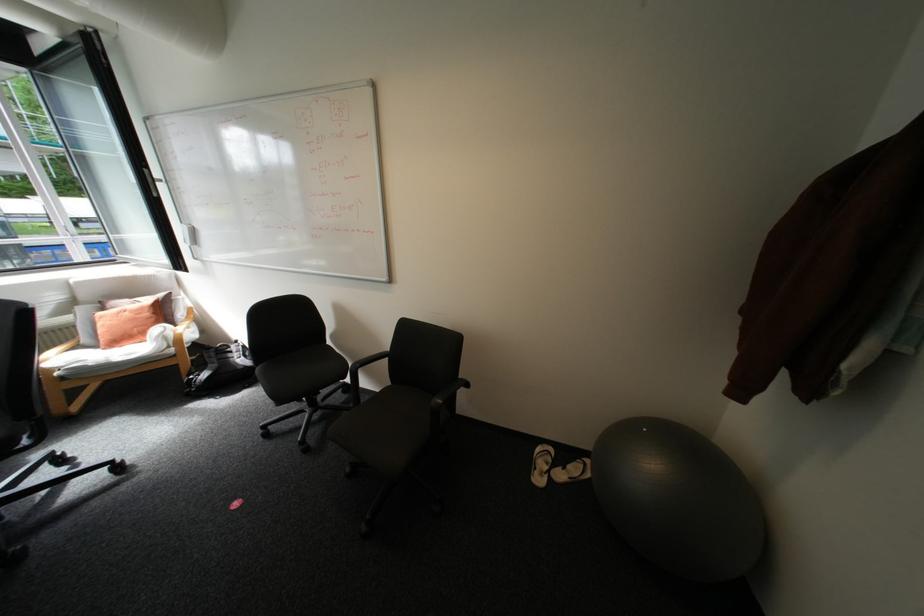
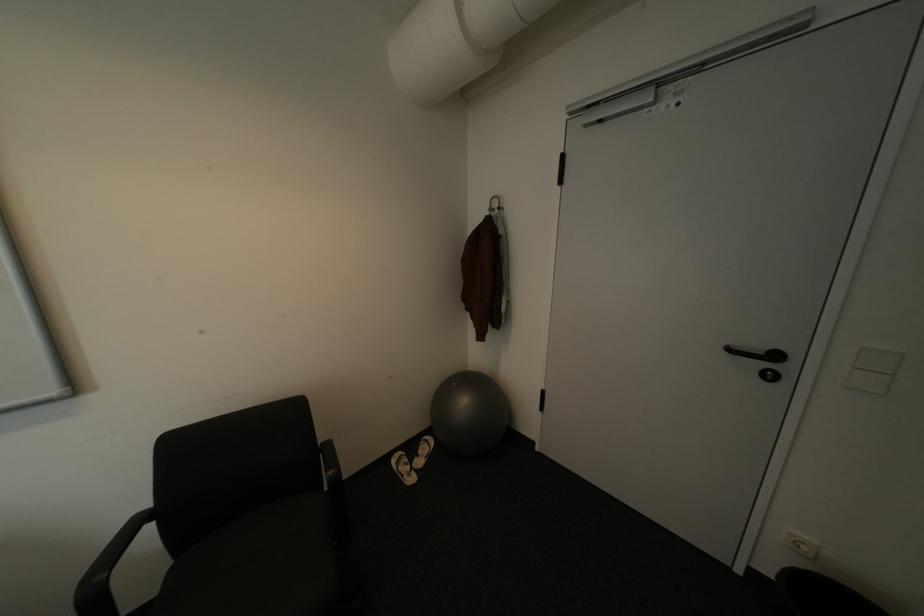
Question: Based on the continuous images, in which direction is the camera rotating? Reply with the corresponding letter.

Choices:
 (A) Left
 (B) Right
 (C) Up
 (D) Down

Answer: (B)